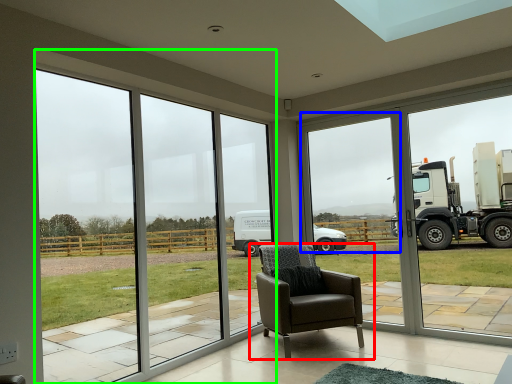
Question: Considering the real-world distances, which object is closest to chair (highlighted by a red box)? window screen (highlighted by a blue box) or window (highlighted by a green box).

Choices:
 (A) window screen
 (B) window

Answer: (B)